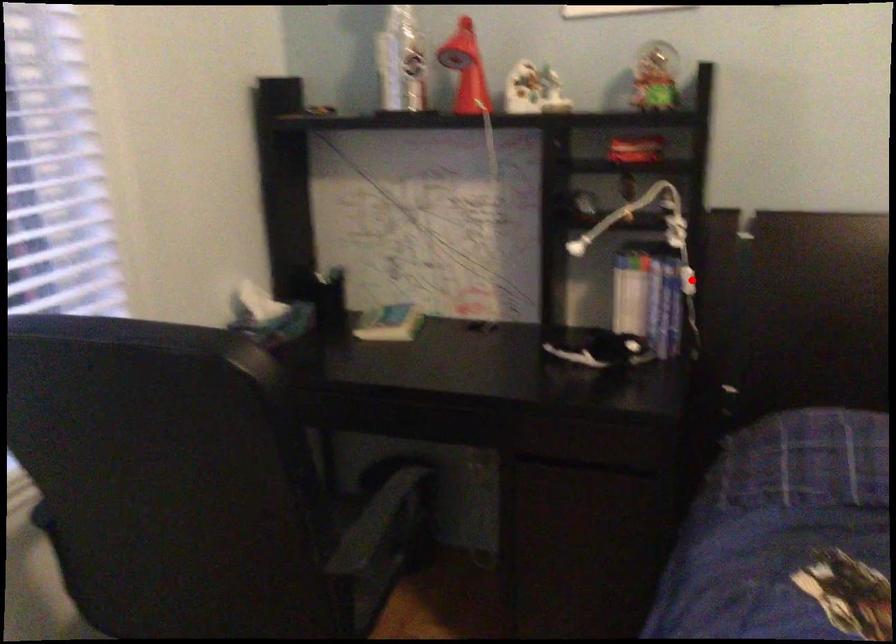
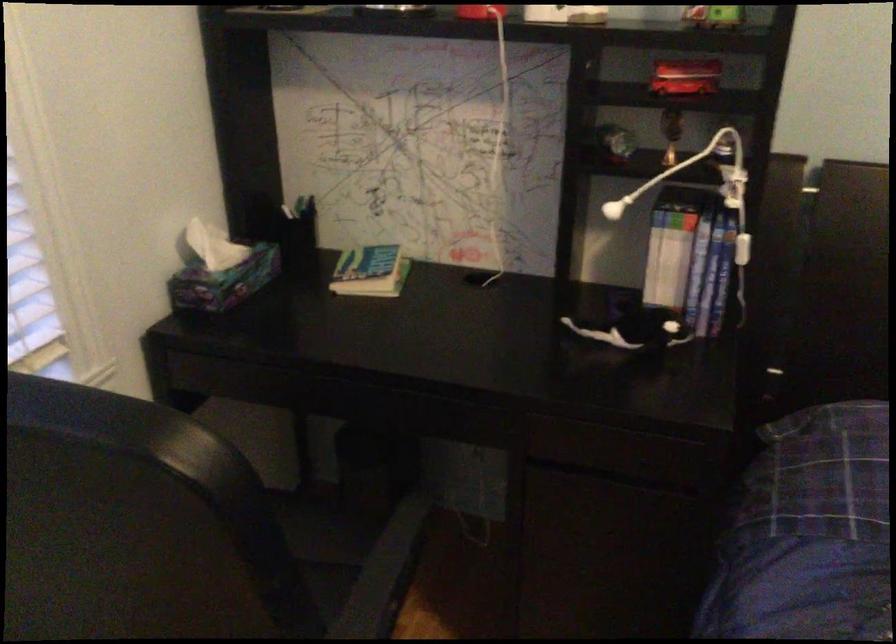
Locate, in the second image, the point that corresponds to the highlighted location in the first image.

(742, 249)